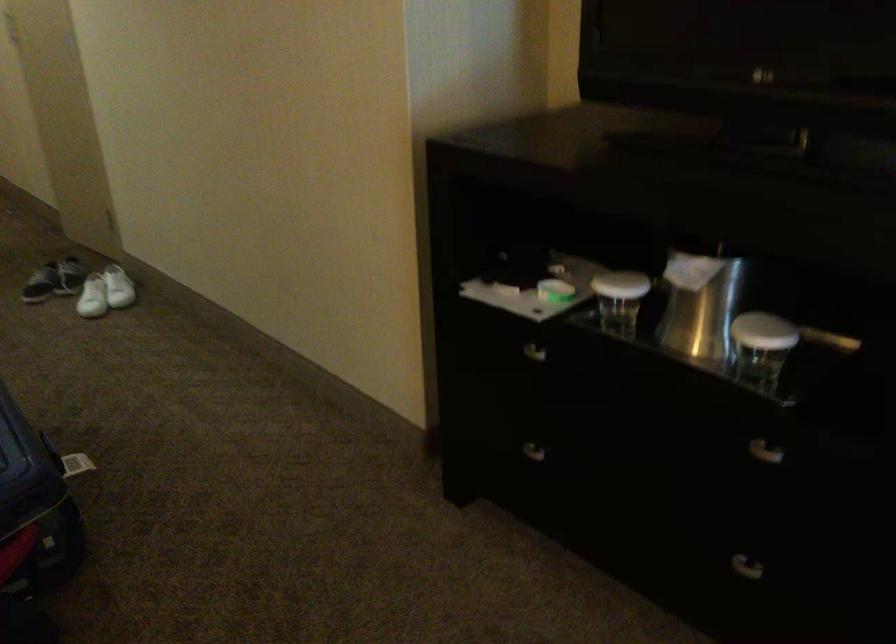
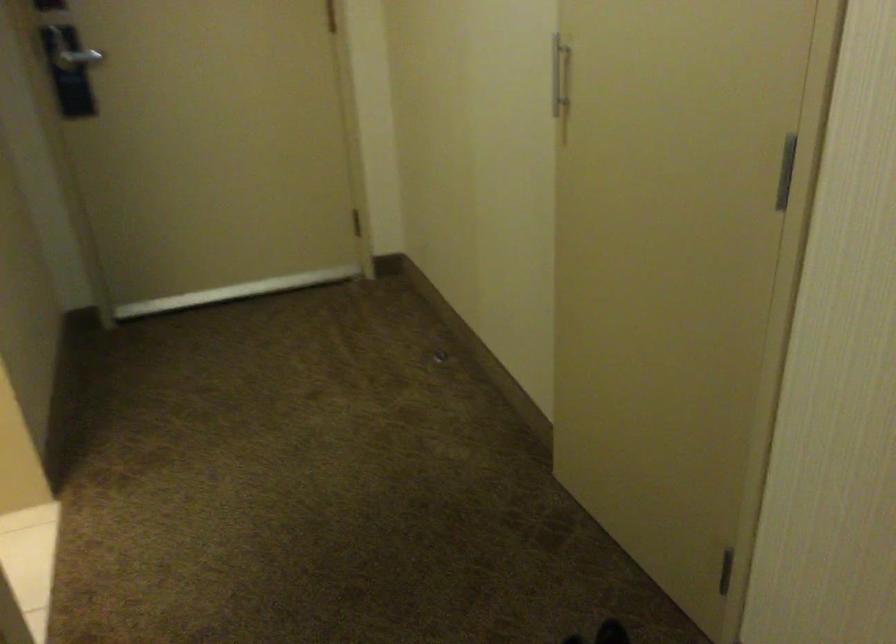
What movement of the cameraman would produce the second image?

The cameraman moved toward left, forward.